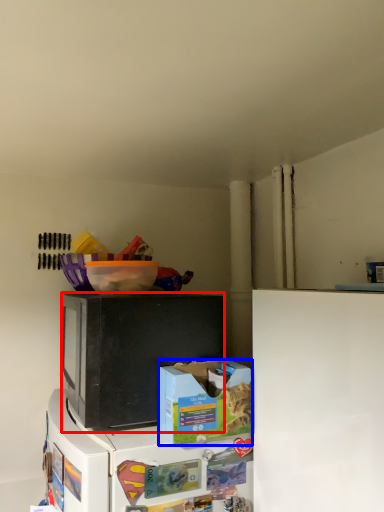
Question: Among these objects, which one is farthest to the camera, microwave oven (highlighted by a red box) or box (highlighted by a blue box)?

Choices:
 (A) microwave oven
 (B) box

Answer: (A)